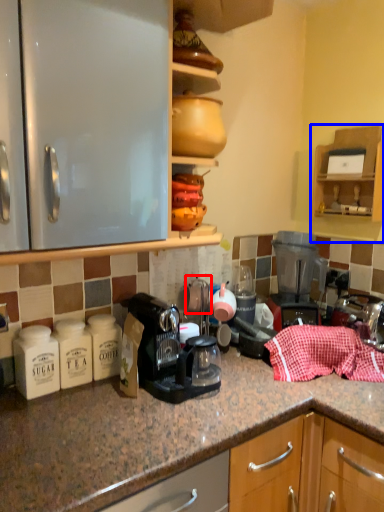
Question: Which of the following is the farthest to the observer, tea pot (highlighted by a red box) or cabinetry (highlighted by a blue box)?

Choices:
 (A) tea pot
 (B) cabinetry

Answer: (B)